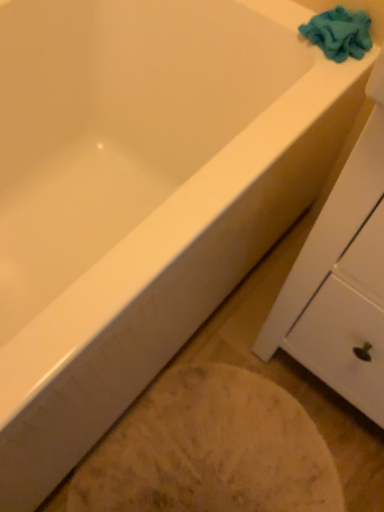
In order to click on free point above white glossy bathtub at lower left (from a real-world perspective) in this screenshot , I will do `click(214, 458)`.